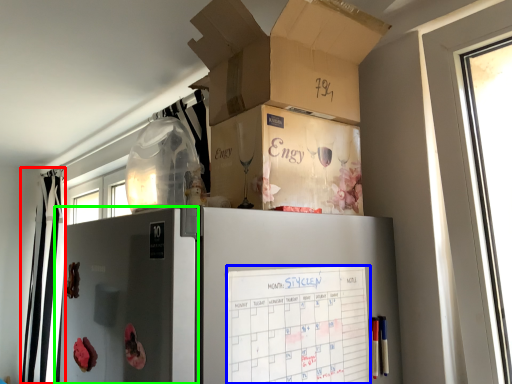
Question: Which object is positioned farthest from curtain (highlighted by a red box)? Select from checklist (highlighted by a blue box) and screen door (highlighted by a green box).

Choices:
 (A) checklist
 (B) screen door

Answer: (A)